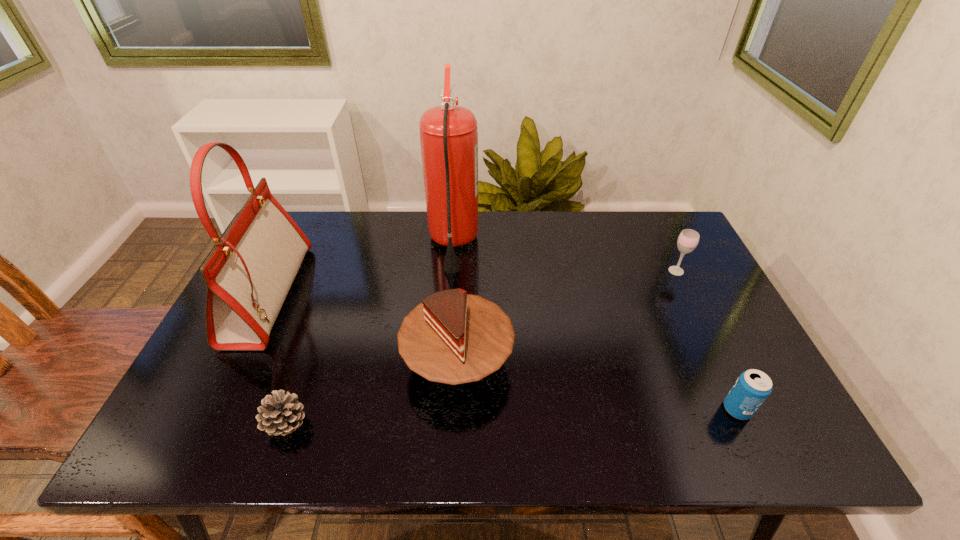
Where is `object at the far left corner`? This screenshot has width=960, height=540. object at the far left corner is located at coordinates (248, 274).

Locate an element on the screen. The height and width of the screenshot is (540, 960). object at the near right corner is located at coordinates (752, 388).

Locate an element on the screen. vacant region at the far edge is located at coordinates (581, 242).

Find the location of a particular element. Image resolution: width=960 pixels, height=540 pixels. free region at the near edge is located at coordinates (517, 427).

Locate an element on the screen. The image size is (960, 540). free space at the left edge of the desktop is located at coordinates (225, 356).

This screenshot has width=960, height=540. I want to click on vacant region at the right edge of the desktop, so click(663, 283).

The width and height of the screenshot is (960, 540). Identify the location of vacant point at the far left corner. (314, 250).

In the image, there is a desktop. Identify the location of vacant space at the near left corner. (210, 441).

Identify the location of unoccupied position between the fire extinguisher and the leftmost object. (361, 269).

The height and width of the screenshot is (540, 960). In order to click on blank region between the shortest object and the cake in this screenshot , I will do `click(372, 393)`.